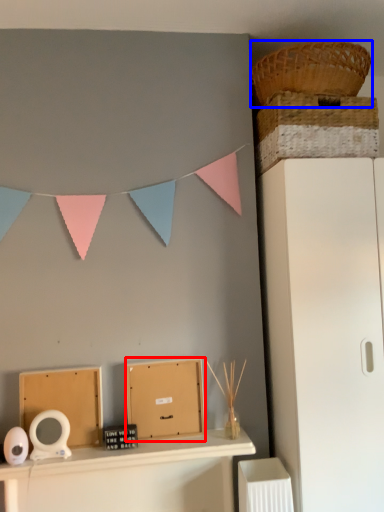
Question: Which point is further to the camera, cardboard box (highlighted by a red box) or basket (highlighted by a blue box)?

Choices:
 (A) cardboard box
 (B) basket

Answer: (A)